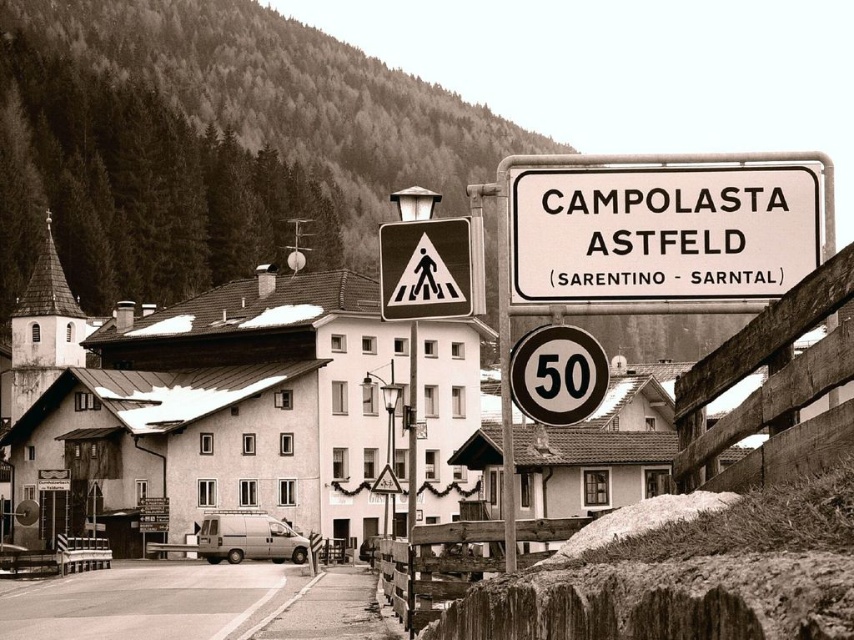
Question: Among these points, which one is nearest to the camera?

Choices:
 (A) (527, 384)
 (B) (366, 440)
 (C) (656, 273)

Answer: (C)

Question: Which object is farther from the camera taking this photo?

Choices:
 (A) metal pedestrian crossing sign at center
 (B) white paper sign at upper center

Answer: (B)

Question: Which of the following is the closest to the observer?

Choices:
 (A) white paper sign at upper center
 (B) metal pedestrian crossing sign at center

Answer: (B)

Question: Can you confirm if white matte building at center is bigger than metallic circular speed limit sign at center?

Choices:
 (A) yes
 (B) no

Answer: (A)

Question: Is the position of white matte building at center less distant than that of white paper sign at upper center?

Choices:
 (A) no
 (B) yes

Answer: (A)

Question: Can you confirm if white matte building at center is wider than metal pedestrian crossing sign at center?

Choices:
 (A) yes
 (B) no

Answer: (A)